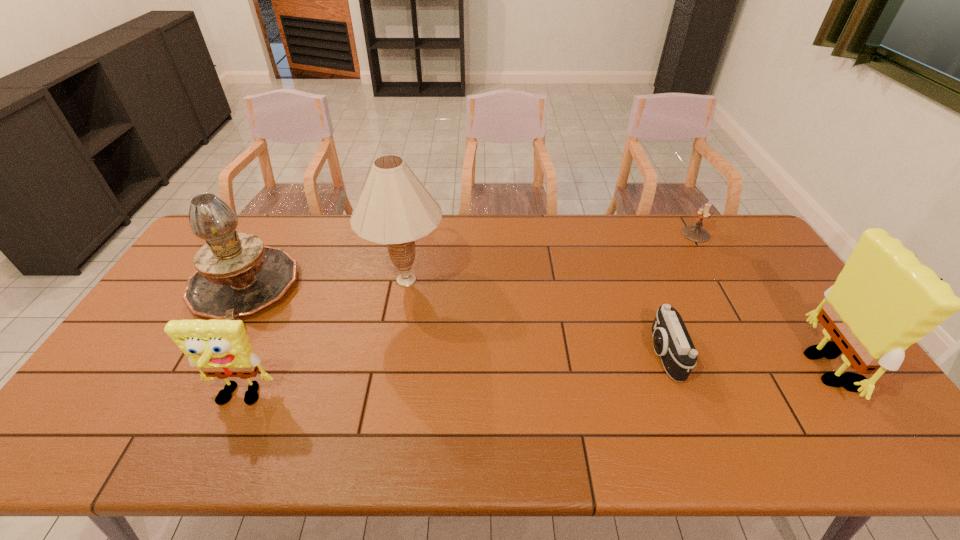
Locate an element on the screen. free location at the near left corner is located at coordinates (132, 390).

In the image, there is a desktop. Identify the location of blank space at the far right corner. (716, 251).

Image resolution: width=960 pixels, height=540 pixels. In order to click on empty space between the third tallest object and the right sponge in this screenshot , I will do `click(540, 328)`.

Where is `free area in between the shorter sponge and the fifth object from left to right`? Image resolution: width=960 pixels, height=540 pixels. free area in between the shorter sponge and the fifth object from left to right is located at coordinates (468, 316).

Identify the location of vacant space that is in between the fourth object from right to left and the taller sponge. This screenshot has height=540, width=960. (621, 324).

Locate an element on the screen. The width and height of the screenshot is (960, 540). free spot between the fifth object from left to right and the lampshade is located at coordinates (551, 257).

The height and width of the screenshot is (540, 960). In order to click on vacant space that is in between the shortest object and the oil lamp in this screenshot , I will do `click(454, 321)`.

This screenshot has width=960, height=540. In order to click on vacant point located between the third shortest object and the rightmost object in this screenshot , I will do `click(538, 383)`.

Find the location of a particular element. empty space between the second shortest object and the fourth tallest object is located at coordinates (468, 316).

I want to click on vacant space that's between the fourth object from right to left and the oil lamp, so click(x=324, y=284).